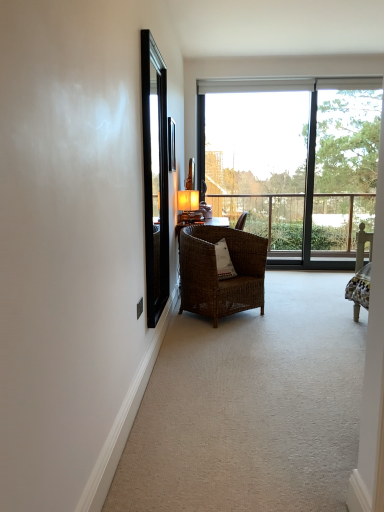
What do you see at coordinates (155, 176) in the screenshot? The image size is (384, 512). I see `black glass screen door at left` at bounding box center [155, 176].

The image size is (384, 512). Describe the element at coordinates (251, 407) in the screenshot. I see `woven wicker chair at center` at that location.

What is the approximate height of woven wicker chair at center?

It is 1.29 inches.

At what (x,y) coordinates should I click in order to perform the action: click on transparent glass window at center. Please return your answer as a coordinate pair (x, y). Looking at the image, I should click on (293, 161).

I want to click on matte gold table lamp at center, so click(x=189, y=206).

This screenshot has width=384, height=512. What do you see at coordinates (216, 272) in the screenshot? I see `woven brown chair at center` at bounding box center [216, 272].

What is the approximate width of woven brown chair at center?

The width of woven brown chair at center is 24.38 inches.

The image size is (384, 512). I want to click on black glass screen door at left, so click(x=155, y=176).

From the image's perspective, is black glass screen door at left on top of transparent glass window at center?

Incorrect, from the image's perspective, black glass screen door at left is lower than transparent glass window at center.

What's the angular difference between black glass screen door at left and transparent glass window at center's facing directions?

They differ by 89.5 degrees in their facing directions.

Is black glass screen door at left turned away from transparent glass window at center?

That's not correct — black glass screen door at left is not looking away from transparent glass window at center.

In terms of size, does black glass screen door at left appear bigger or smaller than transparent glass window at center?

In the image, black glass screen door at left appears to be smaller than transparent glass window at center.

From the image's perspective, is woven brown chair at center positioned above or below transparent glass window at center?

woven brown chair at center is situated lower than transparent glass window at center in the image.

From a real-world perspective, which object rests below the other?

In real-world perspective, woven brown chair at center is lower.

Which is more to the right, woven brown chair at center or transparent glass window at center?

From the viewer's perspective, transparent glass window at center appears more on the right side.

Does black glass screen door at left turn towards matte gold table lamp at center?

No, black glass screen door at left does not turn towards matte gold table lamp at center.

Between black glass screen door at left and matte gold table lamp at center, which one appears on the left side from the viewer's perspective?

From the viewer's perspective, black glass screen door at left appears more on the left side.

Does black glass screen door at left contain matte gold table lamp at center?

No, matte gold table lamp at center is not a part of black glass screen door at left.

From a real-world perspective, is black glass screen door at left positioned over matte gold table lamp at center based on gravity?

Yes, from a real-world perspective, black glass screen door at left is over matte gold table lamp at center

Consider the image. In terms of width, does matte gold table lamp at center look wider or thinner when compared to woven brown chair at center?

In the image, matte gold table lamp at center appears to be more narrow than woven brown chair at center.

This screenshot has width=384, height=512. What are the coordinates of `table lamp above the woven brown chair at center (from the image's perspective)` in the screenshot? It's located at (189, 206).

Which is behind, matte gold table lamp at center or woven brown chair at center?

Positioned behind is matte gold table lamp at center.

Between matte gold table lamp at center and woven brown chair at center, which one appears on the left side from the viewer's perspective?

matte gold table lamp at center.

Considering the relative sizes of woven wicker chair at center and black glass screen door at left in the image provided, is woven wicker chair at center wider than black glass screen door at left?

Yes, woven wicker chair at center is wider than black glass screen door at left.

Is woven wicker chair at center inside or outside of black glass screen door at left?

The correct answer is: outside.

Who is taller, woven wicker chair at center or black glass screen door at left?

black glass screen door at left is taller.

From the image's perspective, would you say transparent glass window at center is shown under woven wicker chair at center?

No, from the image's perspective, transparent glass window at center is not below woven wicker chair at center.

Is transparent glass window at center bigger or smaller than woven wicker chair at center?

In the image, transparent glass window at center appears to be larger than woven wicker chair at center.

The width and height of the screenshot is (384, 512). What are the coordinates of `window that appears above the woven wicker chair at center (from the image's perspective)` in the screenshot? It's located at (293, 161).

Which of these two, transparent glass window at center or woven wicker chair at center, stands shorter?

woven wicker chair at center is shorter.

Measure the distance from transparent glass window at center to woven brown chair at center.

2.10 meters.

Is point (309, 190) positioned behind point (202, 285)?

That is True.

From a real-world perspective, is transparent glass window at center physically above woven brown chair at center?

Yes, from a real-world perspective, transparent glass window at center is on top of woven brown chair at center.

Is transparent glass window at center positioned with its back to woven brown chair at center?

transparent glass window at center does not have its back to woven brown chair at center.

Identify the location of window lying on the right of black glass screen door at left. (293, 161).

Find the location of `chair below the transparent glass window at center (from the image's perspective)`. chair below the transparent glass window at center (from the image's perspective) is located at coordinates (216, 272).

When comparing their distances from woven wicker chair at center, does woven brown chair at center or matte gold table lamp at center seem further?

matte gold table lamp at center is further to woven wicker chair at center.

Considering their positions, is matte gold table lamp at center positioned closer to woven brown chair at center than transparent glass window at center?

matte gold table lamp at center is positioned closer to the anchor woven brown chair at center.

When comparing their distances from matte gold table lamp at center, does woven wicker chair at center or woven brown chair at center seem further?

The object further to matte gold table lamp at center is woven wicker chair at center.

When comparing their distances from black glass screen door at left, does woven brown chair at center or matte gold table lamp at center seem closer?

Among the two, woven brown chair at center is located nearer to black glass screen door at left.

When comparing their distances from woven brown chair at center, does black glass screen door at left or woven wicker chair at center seem closer?

woven wicker chair at center is closer to woven brown chair at center.

When comparing their distances from matte gold table lamp at center, does woven wicker chair at center or black glass screen door at left seem further?

woven wicker chair at center is positioned further to the anchor matte gold table lamp at center.

Consider the image. From the image, which object appears to be nearer to matte gold table lamp at center, transparent glass window at center or woven brown chair at center?

woven brown chair at center is positioned closer to the anchor matte gold table lamp at center.

Estimate the real-world distances between objects in this image. Which object is closer to matte gold table lamp at center, woven brown chair at center or woven wicker chair at center?

Among the two, woven brown chair at center is located nearer to matte gold table lamp at center.

At what (x,y) coordinates should I click in order to perform the action: click on table lamp between woven brown chair at center and transparent glass window at center along the z-axis. Please return your answer as a coordinate pair (x, y). Looking at the image, I should click on (189, 206).

The image size is (384, 512). In order to click on chair between black glass screen door at left and matte gold table lamp at center along the z-axis in this screenshot , I will do `click(216, 272)`.

Find the location of a particular element. The image size is (384, 512). screen door positioned between woven wicker chair at center and woven brown chair at center from near to far is located at coordinates (155, 176).

You are a GUI agent. You are given a task and a screenshot of the screen. Output one action in this format:
    pyautogui.click(x=<x>, y=<y>)
    Task: Click on the table lamp between black glass screen door at left and transparent glass window at center along the z-axis
    This screenshot has height=512, width=384.
    Given the screenshot: What is the action you would take?
    pyautogui.click(x=189, y=206)